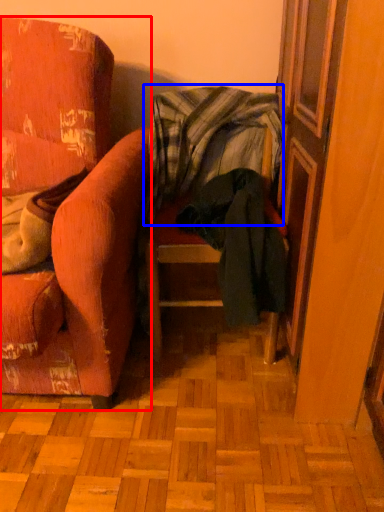
Question: Among these objects, which one is nearest to the camera, chair (highlighted by a red box) or blanket (highlighted by a blue box)?

Choices:
 (A) chair
 (B) blanket

Answer: (A)